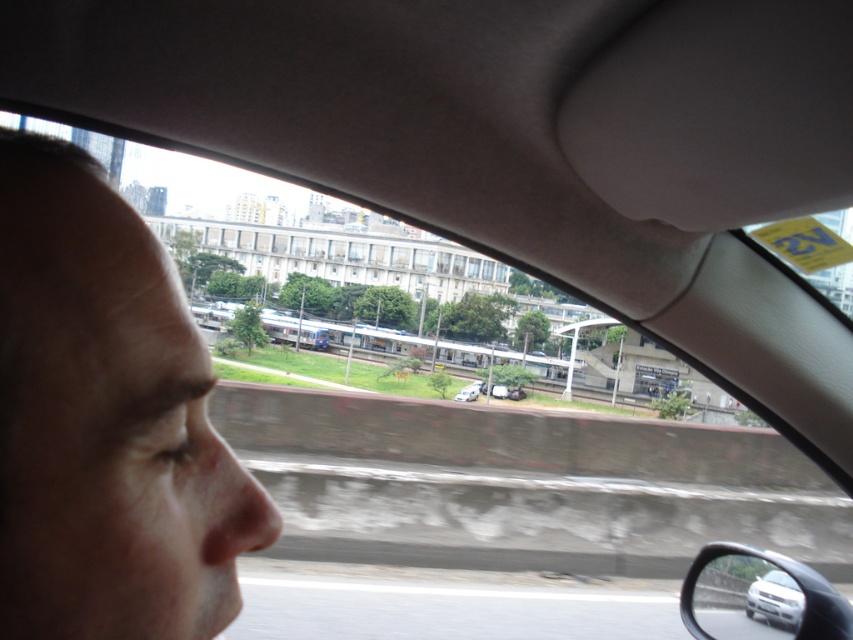
Question: Can you confirm if smooth skin face at left is wider than silver metallic van at center?

Choices:
 (A) yes
 (B) no

Answer: (B)

Question: Which of the following is the farthest from the observer?

Choices:
 (A) silver metallic van at center
 (B) silver metallic car at lower right
 (C) smooth skin face at left

Answer: (A)

Question: Does silver metallic side mirror at lower right appear on the left side of silver metallic van at center?

Choices:
 (A) yes
 (B) no

Answer: (A)

Question: Which is farther from the smooth skin face at left?

Choices:
 (A) silver metallic side mirror at lower right
 (B) silver metallic van at center
 (C) silver metallic car at lower right

Answer: (B)

Question: Which of the following is the closest to the observer?

Choices:
 (A) smooth skin face at left
 (B) silver metallic van at center

Answer: (A)

Question: Does silver metallic side mirror at lower right appear under silver metallic van at center?

Choices:
 (A) no
 (B) yes

Answer: (A)